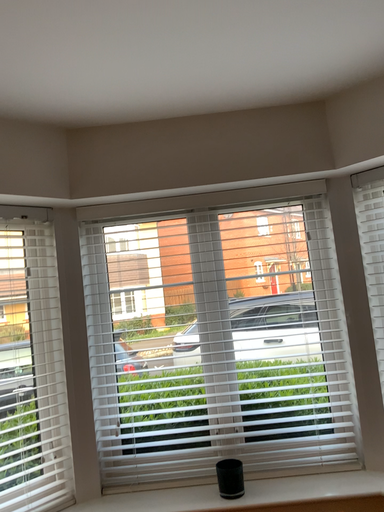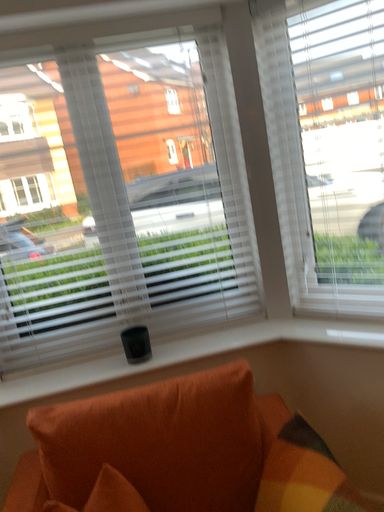
Question: How did the camera likely rotate when shooting the video?

Choices:
 (A) rotated right
 (B) rotated left

Answer: (A)